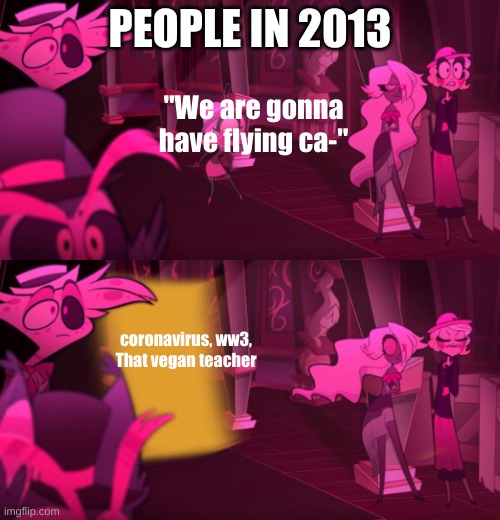
The image size is (500, 520). In order to click on stage floor in this screenshot , I will do `click(299, 476)`, `click(321, 219)`.